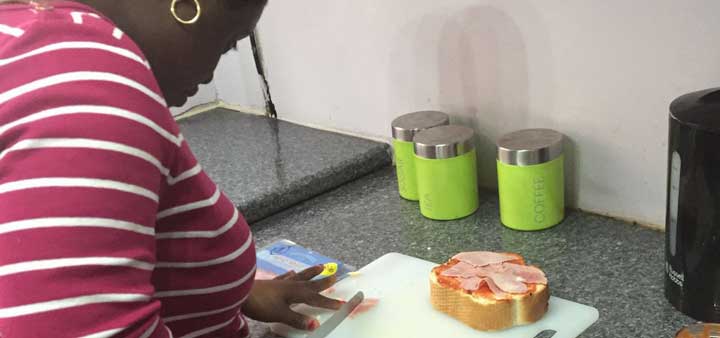
You are a GUI agent. You are given a task and a screenshot of the screen. Output one action in this format:
    pyautogui.click(x=<x>, y=<y>)
    Task: Click on the white wall backing
    The height and width of the screenshot is (338, 720).
    Given the screenshot: What is the action you would take?
    pyautogui.click(x=402, y=55)